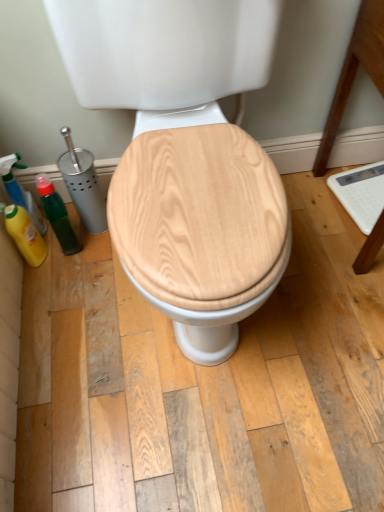
The width and height of the screenshot is (384, 512). Find the location of `vacant area that is in front of wooden toilet seat at center`. vacant area that is in front of wooden toilet seat at center is located at coordinates (209, 438).